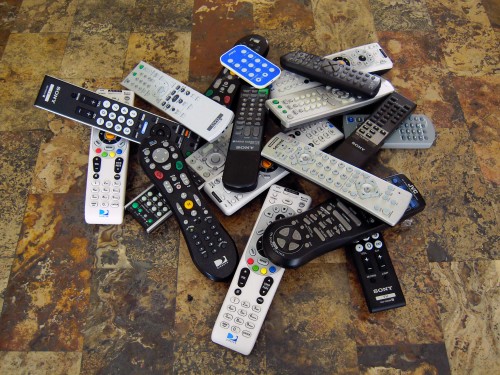
You are a GUI agent. You are given a task and a screenshot of the screen. Output one action in this format:
    pyautogui.click(x=<x>, y=<y>)
    Task: Click on the blue remote
    This screenshot has width=500, height=375.
    Given the screenshot: What is the action you would take?
    pyautogui.click(x=235, y=59)